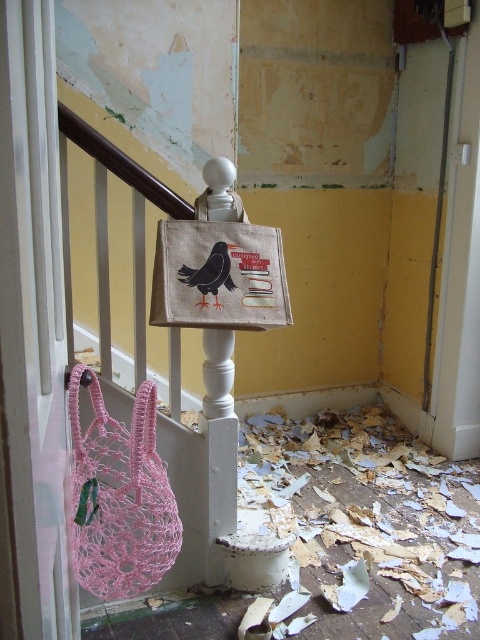
You are a renovator working in the room and need to place a tool. You have a pink crochet bag at lower left. Where should you place it so that it doesn not obstruct the main pathway? Please provide coordinates based on the image grid where the bottom left corner is 0,0 and the top right is 1,1.

The pink crochet bag at lower left is located at point (120, 496). Since the main pathway is likely near the center of the landing, placing the bag at its current coordinates would keep it out of the way. Alternatively, moving it slightly to the lower left corner closer to (144, 448) might ensure it does not block the path.